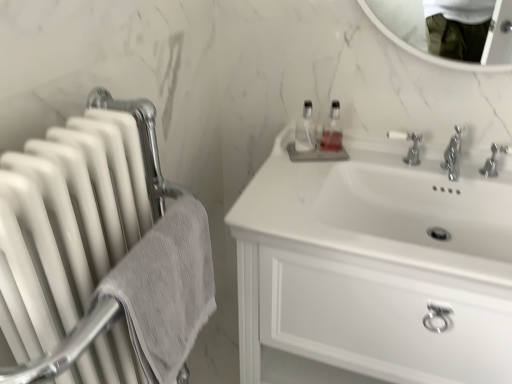
I want to click on vacant region to the left of silver metallic tap at upper center, marked as the second tap in a right-to-left arrangement, so click(353, 163).